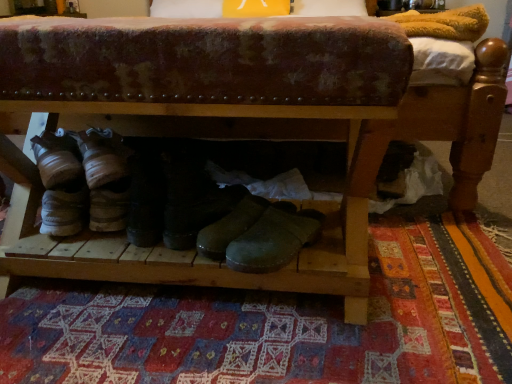
What do you see at coordinates (192, 195) in the screenshot? I see `green leather boot at center, which is the 1th footwear from right to left` at bounding box center [192, 195].

Image resolution: width=512 pixels, height=384 pixels. What are the coordinates of `black leather boots at center, the 2th footwear in the right-to-left sequence` in the screenshot? It's located at (145, 194).

What do you see at coordinates (145, 194) in the screenshot? This screenshot has width=512, height=384. I see `black leather boots at center, which is the first footwear in left-to-right order` at bounding box center [145, 194].

The image size is (512, 384). In order to click on patchwork rug at center in this screenshot , I will do `click(280, 322)`.

You are a GUI agent. You are given a task and a screenshot of the screen. Output one action in this format:
    pyautogui.click(x=<x>, y=<y>)
    Task: Click on the mat in front of the green leather boot at center, placed as the second footwear when sorted from left to right
    The width and height of the screenshot is (512, 384).
    Given the screenshot: What is the action you would take?
    pyautogui.click(x=280, y=322)

From a real-world perspective, who is located lower, green leather boot at center, which is the 1th footwear from right to left, or patchwork rug at center?

patchwork rug at center, from a real-world perspective.

Is green leather boot at center, placed as the second footwear when sorted from left to right, spatially inside patchwork rug at center, or outside of it?

green leather boot at center, placed as the second footwear when sorted from left to right, is not inside patchwork rug at center, it's outside.

Which object is further away from the camera taking this photo, green leather boot at center, placed as the second footwear when sorted from left to right, or patchwork rug at center?

green leather boot at center, placed as the second footwear when sorted from left to right.

Which of these two, patchwork rug at center or green leather boot at center, placed as the second footwear when sorted from left to right, is thinner?

green leather boot at center, placed as the second footwear when sorted from left to right, is thinner.

From the image's perspective, is patchwork rug at center located above or below green leather boot at center, which is the 1th footwear from right to left?

Based on their image positions, patchwork rug at center is located beneath green leather boot at center, which is the 1th footwear from right to left.

From a real-world perspective, who is located lower, patchwork rug at center or green leather boot at center, placed as the second footwear when sorted from left to right?

patchwork rug at center.

Is point (161, 178) positioned in front of point (190, 186)?

No, (161, 178) is further to viewer.

In the scene shown: From a real-world perspective, is black leather boots at center, the 2th footwear in the right-to-left sequence, physically below green leather boot at center, which is the 1th footwear from right to left?

Yes, from a real-world perspective, black leather boots at center, the 2th footwear in the right-to-left sequence, is under green leather boot at center, which is the 1th footwear from right to left.

Is black leather boots at center, which is the first footwear in left-to-right order, wider than green leather boot at center, which is the 1th footwear from right to left?

In fact, black leather boots at center, which is the first footwear in left-to-right order, might be narrower than green leather boot at center, which is the 1th footwear from right to left.

Is patchwork rug at center far from black leather boots at center, the 2th footwear in the right-to-left sequence?

Actually, patchwork rug at center and black leather boots at center, the 2th footwear in the right-to-left sequence, are a little close together.

Which is more to the left, patchwork rug at center or black leather boots at center, which is the first footwear in left-to-right order?

black leather boots at center, which is the first footwear in left-to-right order, is more to the left.

Is patchwork rug at center positioned beyond the bounds of black leather boots at center, which is the first footwear in left-to-right order?

patchwork rug at center is positioned outside black leather boots at center, which is the first footwear in left-to-right order.

Between black leather boots at center, the 2th footwear in the right-to-left sequence, and patchwork rug at center, which one has more height?

Standing taller between the two is black leather boots at center, the 2th footwear in the right-to-left sequence.

From a real-world perspective, relative to patchwork rug at center, is black leather boots at center, the 2th footwear in the right-to-left sequence, vertically above or below?

From a real-world perspective, black leather boots at center, the 2th footwear in the right-to-left sequence, is physically above patchwork rug at center.

From the image's perspective, would you say black leather boots at center, the 2th footwear in the right-to-left sequence, is positioned over patchwork rug at center?

Yes, from the image's perspective, black leather boots at center, the 2th footwear in the right-to-left sequence, is on top of patchwork rug at center.

Find the location of a particular element. The width and height of the screenshot is (512, 384). mat below the black leather boots at center, the 2th footwear in the right-to-left sequence (from a real-world perspective) is located at coordinates (280, 322).

Which of these two, green leather boot at center, placed as the second footwear when sorted from left to right, or black leather boots at center, the 2th footwear in the right-to-left sequence, stands shorter?

black leather boots at center, the 2th footwear in the right-to-left sequence, is shorter.

Between green leather boot at center, placed as the second footwear when sorted from left to right, and black leather boots at center, the 2th footwear in the right-to-left sequence, which one appears on the right side from the viewer's perspective?

green leather boot at center, placed as the second footwear when sorted from left to right.

Which is closer, (166, 246) or (129, 197)?

Positioned in front is point (166, 246).

Where is `mat located underneath the green leather boot at center, placed as the second footwear when sorted from left to right (from a real-world perspective)`? Image resolution: width=512 pixels, height=384 pixels. mat located underneath the green leather boot at center, placed as the second footwear when sorted from left to right (from a real-world perspective) is located at coordinates (280, 322).

This screenshot has height=384, width=512. In the image, there is a green leather boot at center, placed as the second footwear when sorted from left to right. Identify the location of mat below it (from the image's perspective). (280, 322).

When comparing their distances from green leather boot at center, which is the 1th footwear from right to left, does black leather boots at center, which is the first footwear in left-to-right order, or patchwork rug at center seem closer?

Based on the image, black leather boots at center, which is the first footwear in left-to-right order, appears to be nearer to green leather boot at center, which is the 1th footwear from right to left.

From the image, which object appears to be nearer to patchwork rug at center, black leather boots at center, which is the first footwear in left-to-right order, or green leather boot at center, which is the 1th footwear from right to left?

Based on the image, green leather boot at center, which is the 1th footwear from right to left, appears to be nearer to patchwork rug at center.

Looking at the image, which one is located closer to black leather boots at center, the 2th footwear in the right-to-left sequence, patchwork rug at center or green leather boot at center, which is the 1th footwear from right to left?

Based on the image, green leather boot at center, which is the 1th footwear from right to left, appears to be nearer to black leather boots at center, the 2th footwear in the right-to-left sequence.

Estimate the real-world distances between objects in this image. Which object is further from black leather boots at center, the 2th footwear in the right-to-left sequence, green leather boot at center, placed as the second footwear when sorted from left to right, or patchwork rug at center?

patchwork rug at center is positioned further to the anchor black leather boots at center, the 2th footwear in the right-to-left sequence.

When comparing their distances from patchwork rug at center, does green leather boot at center, placed as the second footwear when sorted from left to right, or black leather boots at center, the 2th footwear in the right-to-left sequence, seem closer?

green leather boot at center, placed as the second footwear when sorted from left to right, is closer to patchwork rug at center.

When comparing their distances from green leather boot at center, placed as the second footwear when sorted from left to right, does patchwork rug at center or black leather boots at center, the 2th footwear in the right-to-left sequence, seem further?

Based on the image, patchwork rug at center appears to be further to green leather boot at center, placed as the second footwear when sorted from left to right.

Identify the location of footwear between patchwork rug at center and black leather boots at center, the 2th footwear in the right-to-left sequence, from front to back. (192, 195).